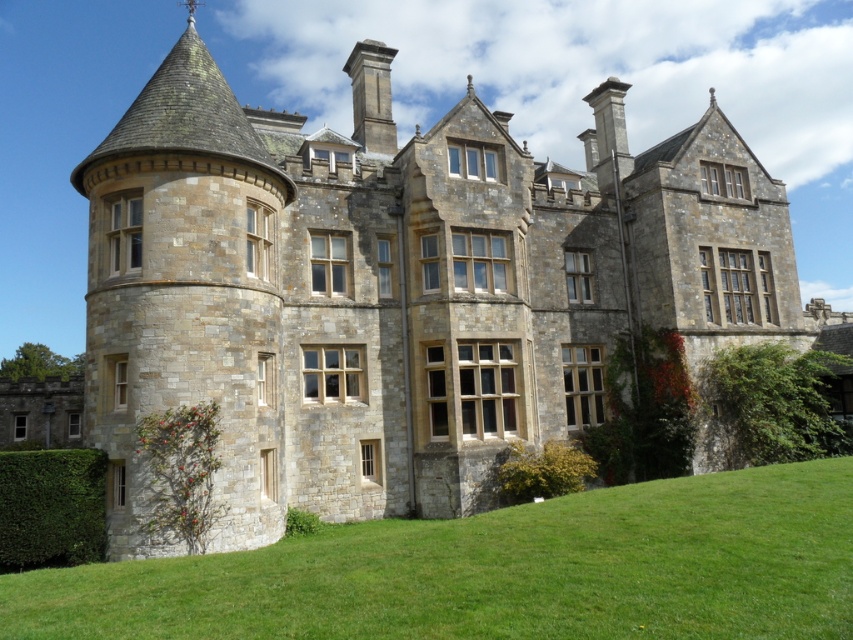
Can you confirm if green grass at lower center is positioned above green leafy hedge at right?

Actually, green grass at lower center is below green leafy hedge at right.

Is green grass at lower center taller than green leafy hedge at right?

In fact, green grass at lower center may be shorter than green leafy hedge at right.

Image resolution: width=853 pixels, height=640 pixels. What do you see at coordinates (498, 572) in the screenshot?
I see `green grass at lower center` at bounding box center [498, 572].

Identify the location of green grass at lower center. (498, 572).

Can you confirm if green grass at lower center is smaller than green leafy hedge at lower center?

No, green grass at lower center is not smaller than green leafy hedge at lower center.

Is green grass at lower center further to camera compared to green leafy hedge at lower center?

No, green grass at lower center is closer to the viewer.

Does point (608, 602) lie in front of point (529, 493)?

Yes.

At what (x,y) coordinates should I click in order to perform the action: click on green grass at lower center. Please return your answer as a coordinate pair (x, y). Looking at the image, I should click on (498, 572).

Can you confirm if green leafy hedge at right is positioned to the left of green leafy hedge at lower center?

No, green leafy hedge at right is not to the left of green leafy hedge at lower center.

Identify the location of green leafy hedge at right. (770, 404).

This screenshot has width=853, height=640. I want to click on green leafy hedge at right, so click(x=770, y=404).